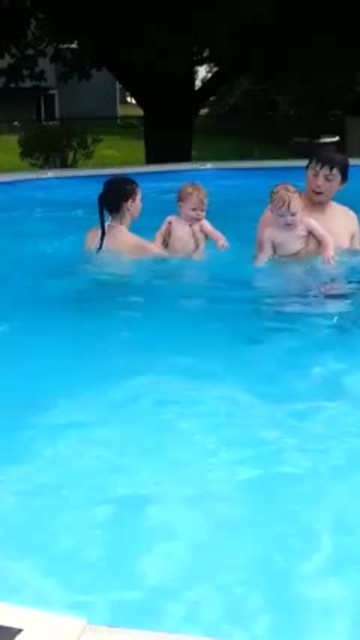
You are a photographer trying to capture a clear shot of both the smooth skin baby at upper right and the blonde hair baby at center. Based on their positions, which baby is more likely to be in the foreground of the photo?

The smooth skin baby at upper right is more likely to be in the foreground because it is positioned closer to the camera than the blonde hair baby at center.

You are a photographer trying to capture a closeup of the two points in the image. Which point, point (262, 216) or point (218, 237), will appear larger in your photo?

Point (262, 216) is closer to the viewer than point (218, 237), so it will appear larger in the photo.

In the scene of a family at the swimming pool, there are two babies described as smooth skin baby at upper right and smooth skin baby at center. Which baby is bigger in size?

The smooth skin baby at upper right is larger in size than the smooth skin baby at center.